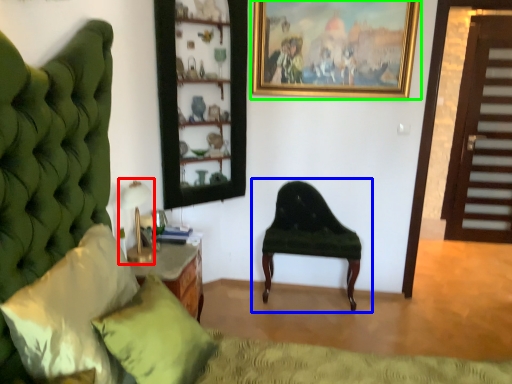
Question: Estimate the real-world distances between objects in this image. Which object is closer to table lamp (highlighted by a red box), chair (highlighted by a blue box) or picture frame (highlighted by a green box)?

Choices:
 (A) chair
 (B) picture frame

Answer: (A)